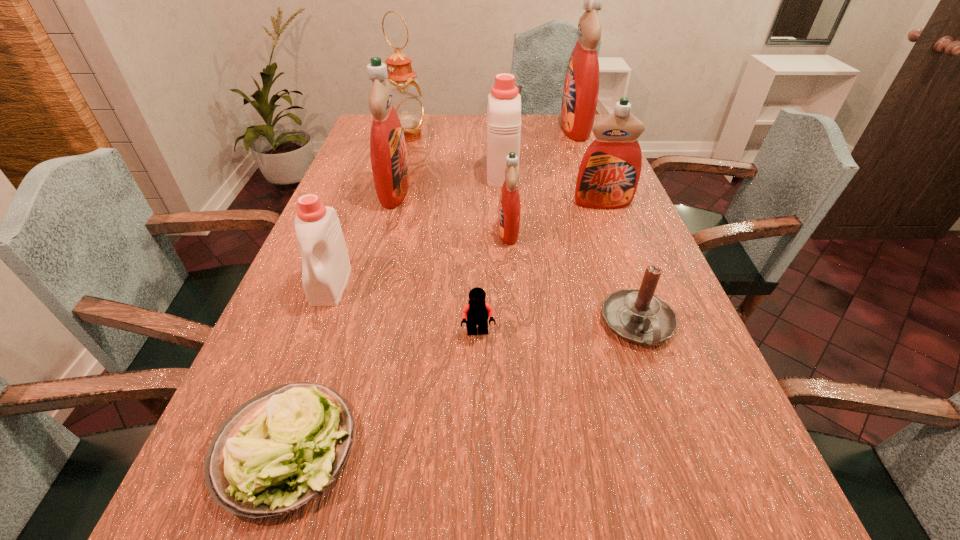
Where is `free space between the shortest object and the sixth farthest object`? free space between the shortest object and the sixth farthest object is located at coordinates (397, 340).

Find the location of `unoccupied area between the black Lego and the tallest detergent`. unoccupied area between the black Lego and the tallest detergent is located at coordinates (527, 231).

Identify the location of object that stands as the seventh closest to the oil lamp. (477, 311).

Locate an element on the screen. object that is the eighth closest to the tallest detergent is located at coordinates tap(477, 311).

You are a GUI agent. You are given a task and a screenshot of the screen. Output one action in this format:
    pyautogui.click(x=<x>, y=<y>)
    Task: Click on the detergent object that ranks as the fourth closest to the second smallest red detergent
    The width and height of the screenshot is (960, 540).
    Given the screenshot: What is the action you would take?
    pyautogui.click(x=388, y=153)

Identify which detergent is the third closest to the Lego. Please provide its 2D coordinates. Your answer should be formatted as a tuple, i.e. [(x, y)], where the tuple contains the x and y coordinates of a point satisfying the conditions above.

[(388, 153)]

Locate an element on the screen. The height and width of the screenshot is (540, 960). red detergent that stands as the closest to the farther white detergent is located at coordinates (608, 176).

Locate which red detergent is the closest to the third smallest red detergent. Please provide its 2D coordinates. Your answer should be formatted as a tuple, i.e. [(x, y)], where the tuple contains the x and y coordinates of a point satisfying the conditions above.

[(509, 211)]

Find the location of a particular element. The height and width of the screenshot is (540, 960). blank space that satisfies the following two spatial constraints: 1. on the front surface of the farthest red detergent; 2. on the front side of the shortest object is located at coordinates (697, 449).

You are a GUI agent. You are given a task and a screenshot of the screen. Output one action in this format:
    pyautogui.click(x=<x>, y=<y>)
    Task: Click on the free space that satisfies the following two spatial constraints: 1. on the front surface of the nearest red detergent; 2. on the handle side of the nearer white detergent
    This screenshot has height=540, width=960.
    Given the screenshot: What is the action you would take?
    pyautogui.click(x=513, y=285)